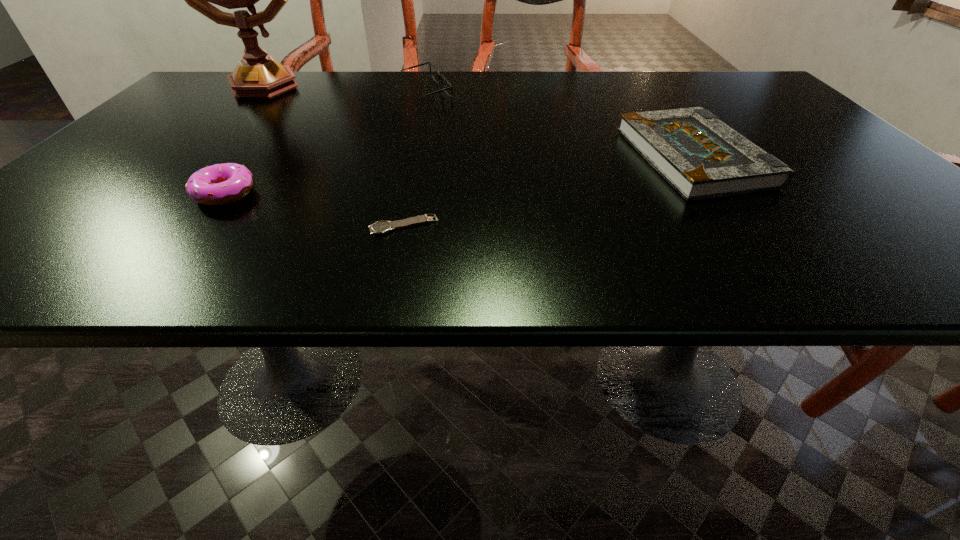
Where is `globe`? Image resolution: width=960 pixels, height=540 pixels. globe is located at coordinates (257, 75).

Locate an element on the screen. This screenshot has width=960, height=540. spectacles is located at coordinates (447, 87).

I want to click on notebook, so click(x=701, y=157).

The height and width of the screenshot is (540, 960). In order to click on doughnut in this screenshot , I will do `click(219, 184)`.

Image resolution: width=960 pixels, height=540 pixels. Find the location of `the nearest object`. the nearest object is located at coordinates (380, 227).

At what (x,y) coordinates should I click in order to perform the action: click on the shortest object. Please return your answer as a coordinate pair (x, y). Looking at the image, I should click on (380, 227).

Find the location of a particular element. free spot located on the front-facing side of the tallest object is located at coordinates (416, 85).

The width and height of the screenshot is (960, 540). Identify the location of vacant space positioned 0.200m with the lenses facing outward on the second tallest object. pos(533,93).

Identify the location of free point located 0.280m on the left of the notebook. Image resolution: width=960 pixels, height=540 pixels. (488, 158).

Identify the location of vacant space located on the back of the doughnut. (250, 161).